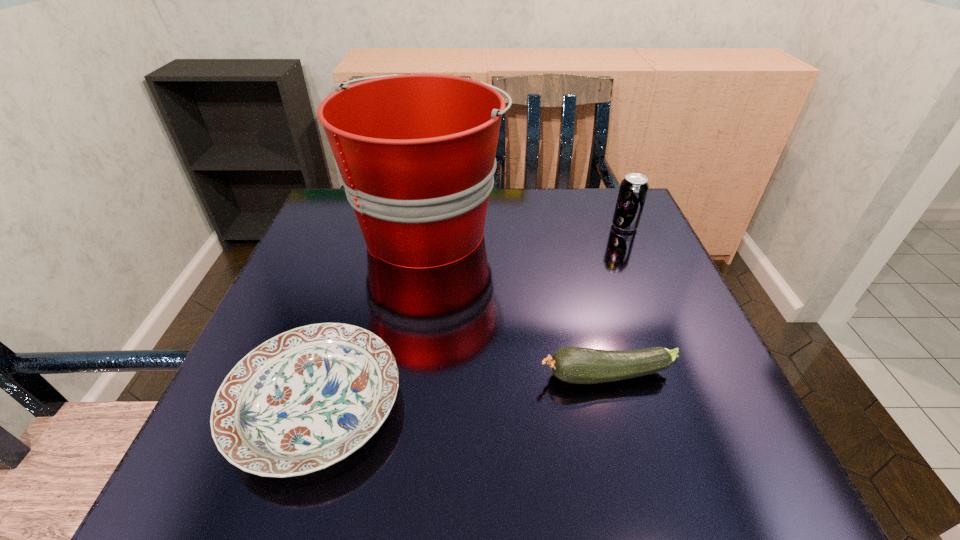
At what (x,y) coordinates should I click in order to perform the action: click on free region that satisfies the following two spatial constraints: 1. on the back side of the second tallest object; 2. on the left side of the plate. Please return your answer as a coordinate pair (x, y). Looking at the image, I should click on (373, 226).

This screenshot has height=540, width=960. Identify the location of vacant space that satisfies the following two spatial constraints: 1. on the back side of the plate; 2. on the right side of the third shortest object. (373, 226).

The image size is (960, 540). I want to click on vacant position in the image that satisfies the following two spatial constraints: 1. on the back side of the shortest object; 2. on the left side of the soda can, so click(x=373, y=226).